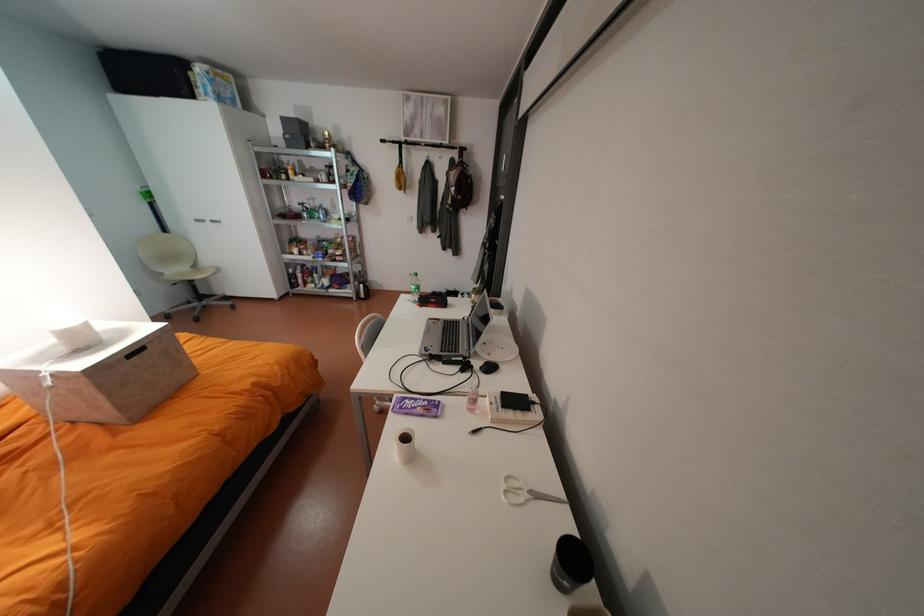
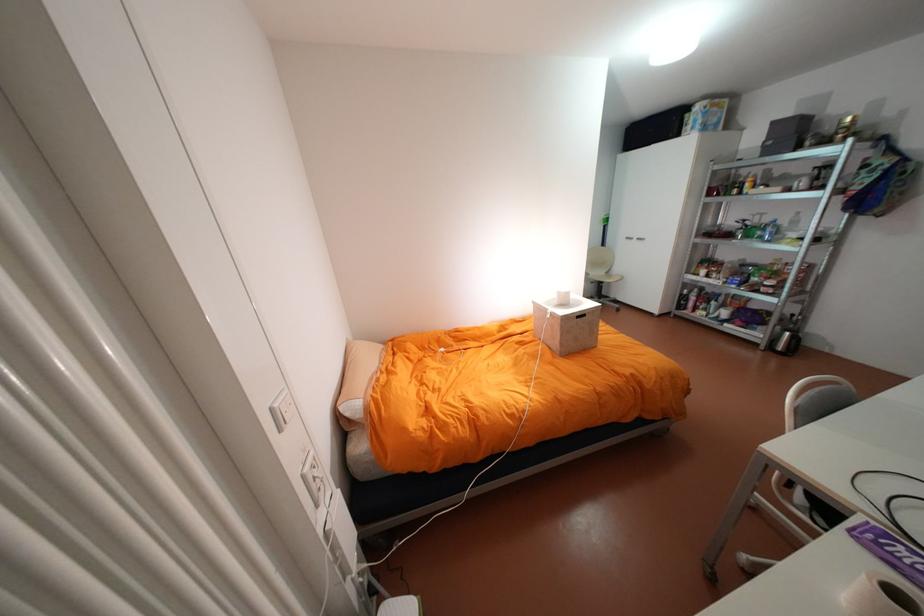
Find the pixel in the second image that matches pixel 326 203 in the first image.

(775, 219)